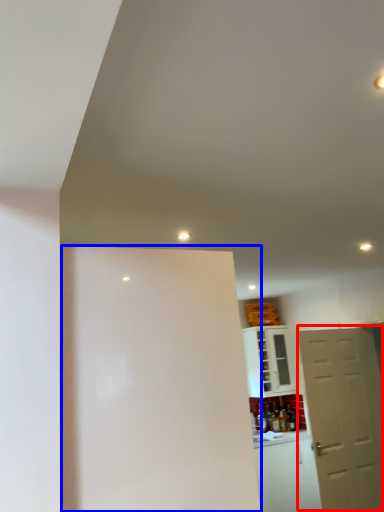
Question: Which object appears closest to the camera in this image, door (highlighted by a red box) or screen door (highlighted by a blue box)?

Choices:
 (A) door
 (B) screen door

Answer: (B)